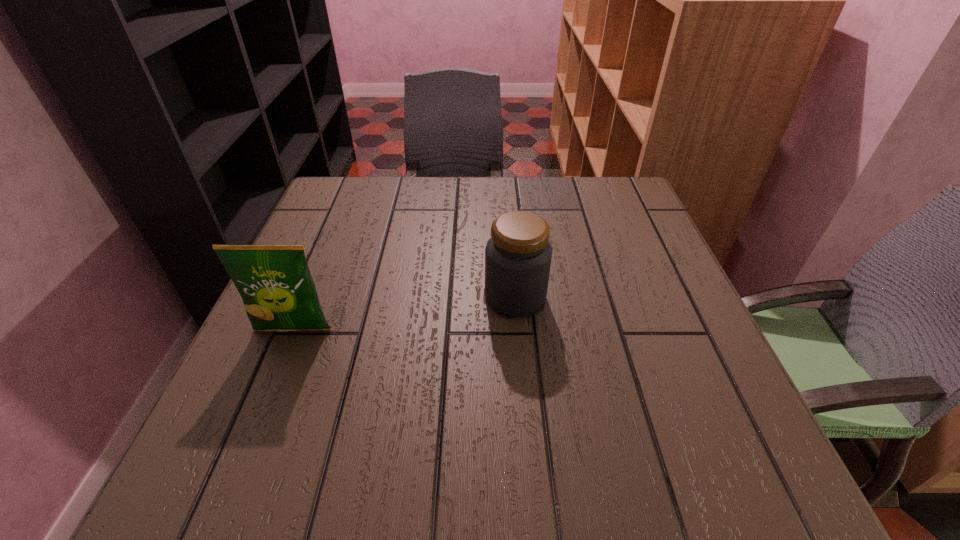
Identify the location of free location that satisfies the following two spatial constraints: 1. on the surface of the jar near the warning symbol; 2. on the front-facing side of the left object. (518, 330).